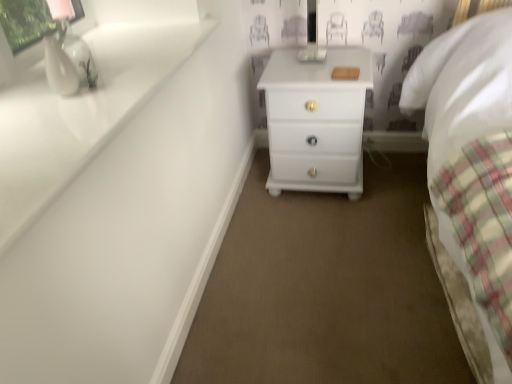
Question: Does white glossy sink at upper left have a greater height compared to white glossy chest of drawers at center?

Choices:
 (A) yes
 (B) no

Answer: (B)

Question: Is white glossy sink at upper left oriented towards white glossy chest of drawers at center?

Choices:
 (A) yes
 (B) no

Answer: (B)

Question: From the image's perspective, would you say white glossy sink at upper left is positioned over white glossy chest of drawers at center?

Choices:
 (A) yes
 (B) no

Answer: (B)

Question: From a real-world perspective, is white glossy sink at upper left under white glossy chest of drawers at center?

Choices:
 (A) yes
 (B) no

Answer: (B)

Question: Is white glossy sink at upper left turned away from white glossy chest of drawers at center?

Choices:
 (A) no
 (B) yes

Answer: (A)

Question: Considering the relative positions of white glossy sink at upper left and white glossy chest of drawers at center in the image provided, is white glossy sink at upper left in front of white glossy chest of drawers at center?

Choices:
 (A) no
 (B) yes

Answer: (B)

Question: From the image's perspective, is white glossy chest of drawers at center located above white glossy vase at upper left?

Choices:
 (A) no
 (B) yes

Answer: (B)

Question: Is white glossy chest of drawers at center positioned in front of white glossy vase at upper left?

Choices:
 (A) no
 (B) yes

Answer: (A)

Question: Is white glossy chest of drawers at center thinner than white glossy vase at upper left?

Choices:
 (A) no
 (B) yes

Answer: (A)

Question: Can you confirm if white glossy chest of drawers at center is taller than white glossy vase at upper left?

Choices:
 (A) no
 (B) yes

Answer: (B)

Question: Can you confirm if white glossy chest of drawers at center is positioned to the left of white glossy vase at upper left?

Choices:
 (A) yes
 (B) no

Answer: (B)

Question: Can you confirm if white glossy chest of drawers at center is shorter than white glossy vase at upper left?

Choices:
 (A) no
 (B) yes

Answer: (A)

Question: Is white glossy chest of drawers at center positioned with its back to white glossy sink at upper left?

Choices:
 (A) yes
 (B) no

Answer: (B)